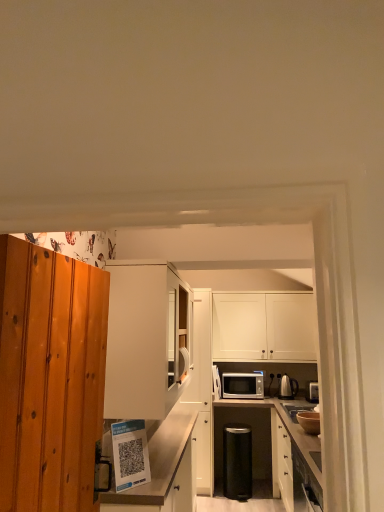
Question: Is white matte cabinet at center, placed as the 2th cabinetry when sorted from right to left, smaller than matte white shelf at lower center, the 2th cabinetry positioned from the left?

Choices:
 (A) yes
 (B) no

Answer: (A)

Question: Is white matte cabinet at center, marked as the 3th cabinetry in a left-to-right arrangement, shorter than matte white shelf at lower center, the 2th cabinetry positioned from the left?

Choices:
 (A) no
 (B) yes

Answer: (A)

Question: Is matte white shelf at lower center, which is the third cabinetry from right to left, surrounded by white matte cabinet at center, placed as the 2th cabinetry when sorted from right to left?

Choices:
 (A) yes
 (B) no

Answer: (B)

Question: Does white matte cabinet at center, marked as the 3th cabinetry in a left-to-right arrangement, appear on the left side of matte white shelf at lower center, the 2th cabinetry positioned from the left?

Choices:
 (A) yes
 (B) no

Answer: (B)

Question: Is white matte cabinet at center, placed as the 2th cabinetry when sorted from right to left, positioned in front of matte white shelf at lower center, which is the third cabinetry from right to left?

Choices:
 (A) no
 (B) yes

Answer: (A)

Question: Is point (240, 374) closer or farther from the camera than point (279, 374)?

Choices:
 (A) closer
 (B) farther

Answer: (A)

Question: Is silver metallic microwave at center inside the boundaries of satin silver kettle at right, which ranks as the second appliance in top-to-bottom order, or outside?

Choices:
 (A) inside
 (B) outside

Answer: (B)

Question: In terms of height, does silver metallic microwave at center look taller or shorter compared to satin silver kettle at right, the 2th appliance when ordered from bottom to top?

Choices:
 (A) tall
 (B) short

Answer: (B)

Question: Looking at their shapes, would you say silver metallic microwave at center is wider or thinner than satin silver kettle at right, which is the first appliance from back to front?

Choices:
 (A) wide
 (B) thin

Answer: (A)

Question: From the image's perspective, is white matte cabinet at center, placed as the first cabinetry when sorted from left to right, located above or below silver metallic microwave at center?

Choices:
 (A) below
 (B) above

Answer: (B)

Question: Based on their sizes in the image, would you say white matte cabinet at center, placed as the first cabinetry when sorted from left to right, is bigger or smaller than silver metallic microwave at center?

Choices:
 (A) small
 (B) big

Answer: (B)

Question: Does point (173, 365) appear closer or farther from the camera than point (241, 396)?

Choices:
 (A) farther
 (B) closer

Answer: (B)

Question: Do you think white matte cabinet at center, placed as the first cabinetry when sorted from left to right, is within silver metallic microwave at center, or outside of it?

Choices:
 (A) outside
 (B) inside

Answer: (A)

Question: Is matte white shelf at lower center, which is the third cabinetry from right to left, bigger or smaller than white matte cabinet at center, which is the 4th cabinetry in right-to-left order?

Choices:
 (A) big
 (B) small

Answer: (A)

Question: In terms of height, does matte white shelf at lower center, which is the third cabinetry from right to left, look taller or shorter compared to white matte cabinet at center, placed as the first cabinetry when sorted from left to right?

Choices:
 (A) short
 (B) tall

Answer: (B)